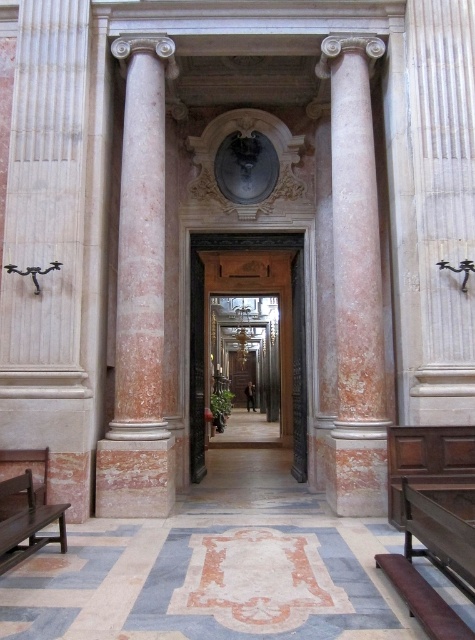
Question: Which object appears closest to the camera in this image?

Choices:
 (A) brown leather bench at lower right
 (B) wooden bench at lower left
 (C) pink marble column at center
 (D) wooden door at center

Answer: (A)

Question: Estimate the real-world distances between objects in this image. Which object is closer to the pink marble column at center?

Choices:
 (A) brown leather bench at lower right
 (B) wooden bench at lower left

Answer: (A)

Question: Is pink marble column at left to the right of brown leather bench at lower right from the viewer's perspective?

Choices:
 (A) no
 (B) yes

Answer: (A)

Question: Among these points, which one is nearest to the camera?

Choices:
 (A) (196, 294)
 (B) (334, 168)
 (C) (121, 237)
 (D) (445, 525)

Answer: (D)

Question: Can you confirm if pink marble column at left is positioned above wooden bench at lower left?

Choices:
 (A) no
 (B) yes

Answer: (B)

Question: Does pink marble column at center have a larger size compared to brown leather bench at lower right?

Choices:
 (A) yes
 (B) no

Answer: (B)